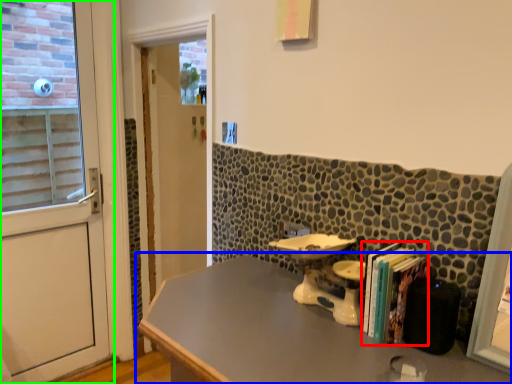
Question: Considering the real-world distances, which object is closest to book (highlighted by a red box)? table (highlighted by a blue box) or door (highlighted by a green box).

Choices:
 (A) table
 (B) door

Answer: (A)